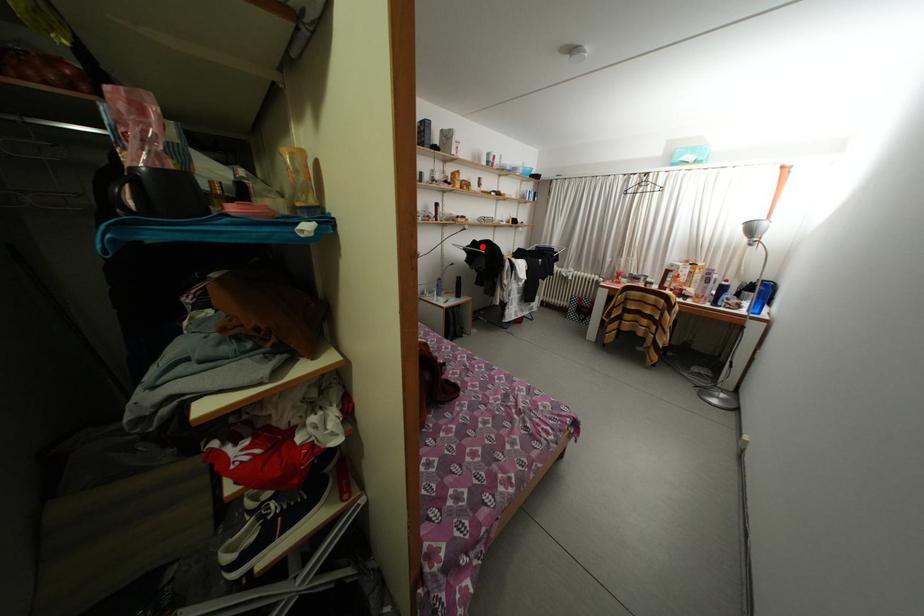
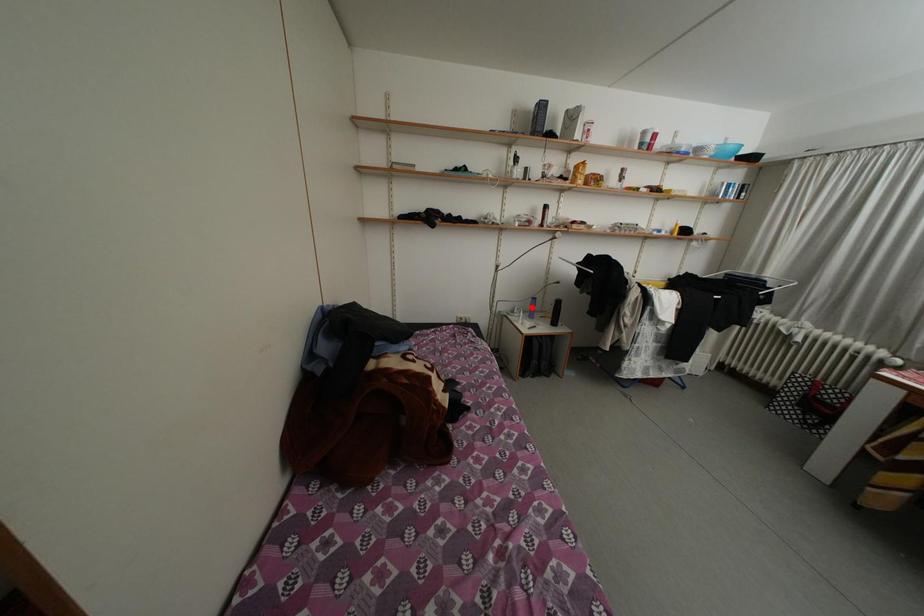
I am providing you with two images of the same scene from different viewpoints. A red point is marked on the first image and another point is marked on the second image. Do the highlighted points in image1 and image2 indicate the same real-world spot?

No